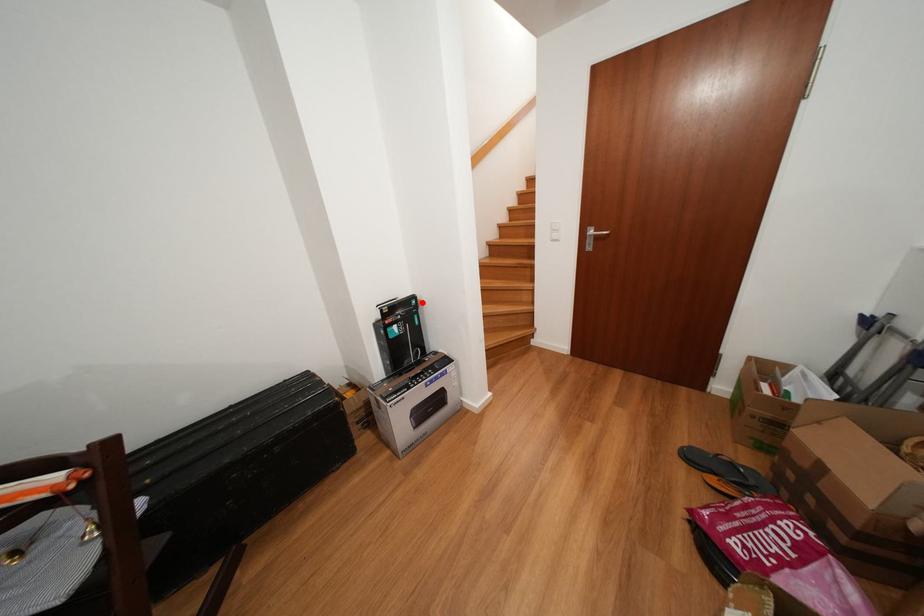
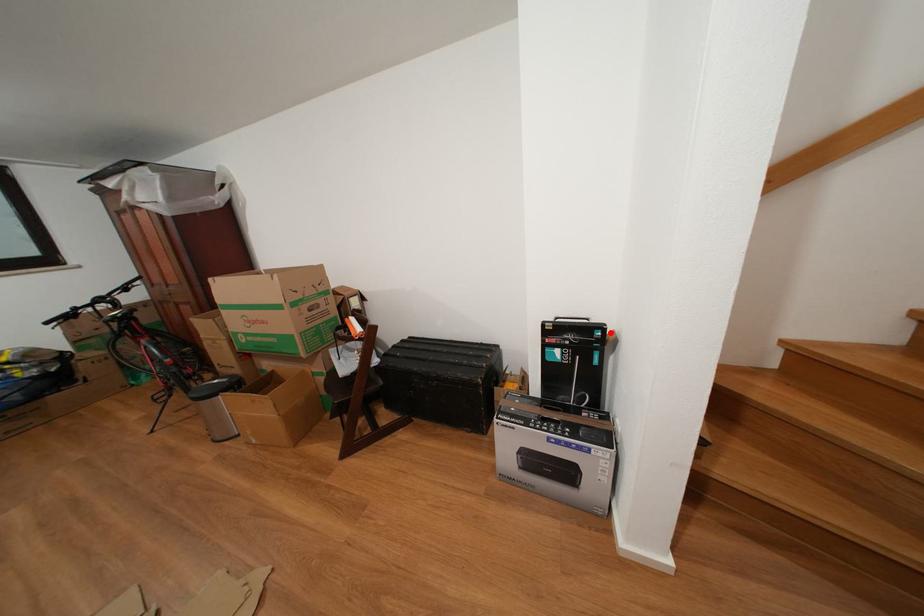
I am providing you with two images of the same scene from different viewpoints. A red point is marked on the first image and another point is marked on the second image. Does the point marked in image1 correspond to the same location as the one in image2?

Yes